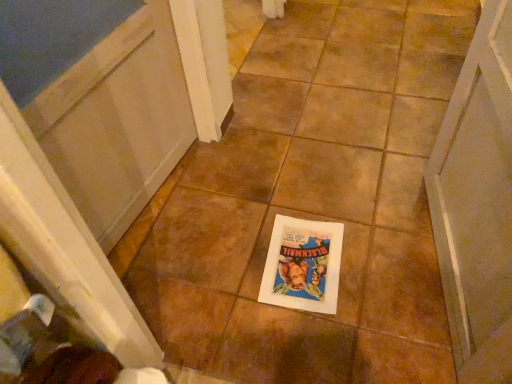
I want to click on vacant point to the left of matte paper book at center, so click(226, 272).